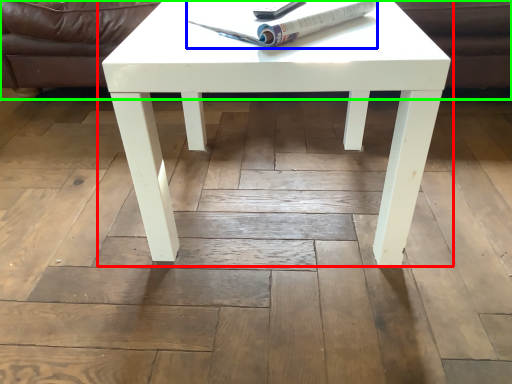
Question: Which object is positioned closest to coffee table (highlighted by a red box)? Select from magazine (highlighted by a blue box) and couch (highlighted by a green box).

Choices:
 (A) magazine
 (B) couch

Answer: (A)